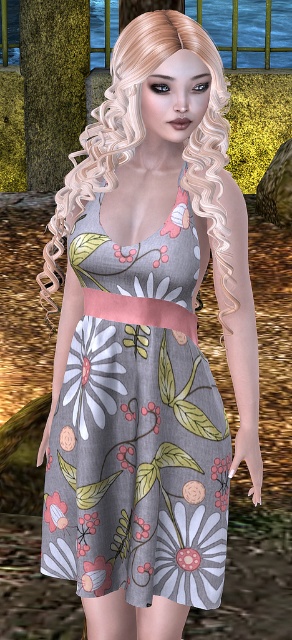
Does blonde curly hair at center have a smaller size compared to floral fabric flower at lower left?

No, blonde curly hair at center is not smaller than floral fabric flower at lower left.

Who is lower down, blonde curly hair at center or floral fabric flower at lower left?

Positioned lower is floral fabric flower at lower left.

Is point (115, 48) closer to camera compared to point (51, 506)?

Yes, point (115, 48) is in front of point (51, 506).

I want to click on blonde curly hair at center, so click(x=143, y=138).

Which is below, floral-patterned fabric dress at center or blonde curly hair at center?

floral-patterned fabric dress at center is below.

Between floral-patterned fabric dress at center and blonde curly hair at center, which one appears on the left side from the viewer's perspective?

blonde curly hair at center

Does point (127, 275) lie in front of point (56, 228)?

Yes, point (127, 275) is closer to viewer.

The height and width of the screenshot is (640, 292). In order to click on floral-patterned fabric dress at center in this screenshot , I will do `click(138, 424)`.

Is point (174, 497) positioned in front of point (56, 497)?

Yes, point (174, 497) is in front of point (56, 497).

Does floral-patterned fabric dress at center have a larger size compared to floral fabric flower at lower left?

Yes, floral-patterned fabric dress at center is bigger than floral fabric flower at lower left.

Where is `floral-patterned fabric dress at center`? floral-patterned fabric dress at center is located at coordinates (138, 424).